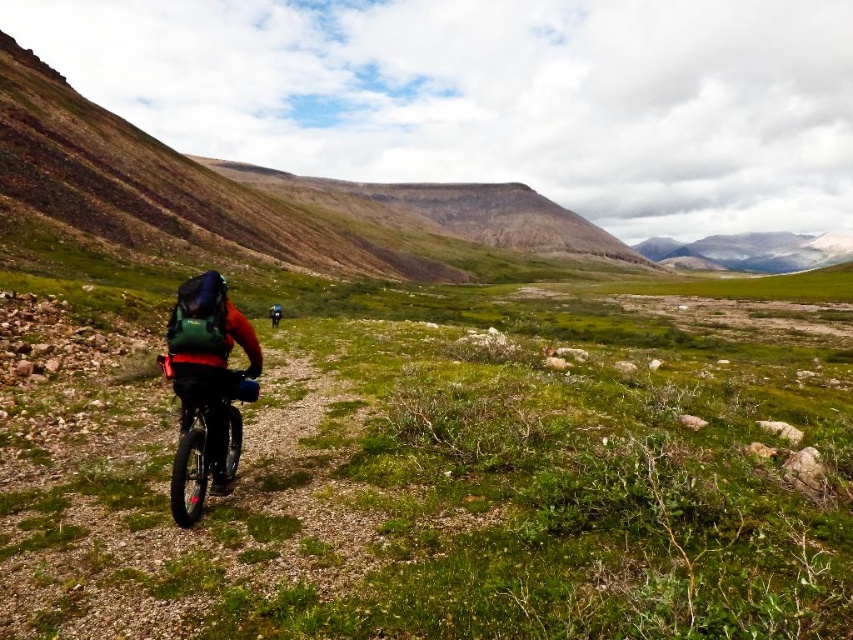
Does point (193, 381) come farther from viewer compared to point (189, 460)?

That is False.

Can you confirm if green matte backpack at center is positioned to the left of shiny black frame at center?

Yes, green matte backpack at center is to the left of shiny black frame at center.

Is point (184, 291) farther from viewer compared to point (190, 500)?

That is True.

Find the location of a particular element. Image resolution: width=853 pixels, height=640 pixels. green matte backpack at center is located at coordinates (209, 362).